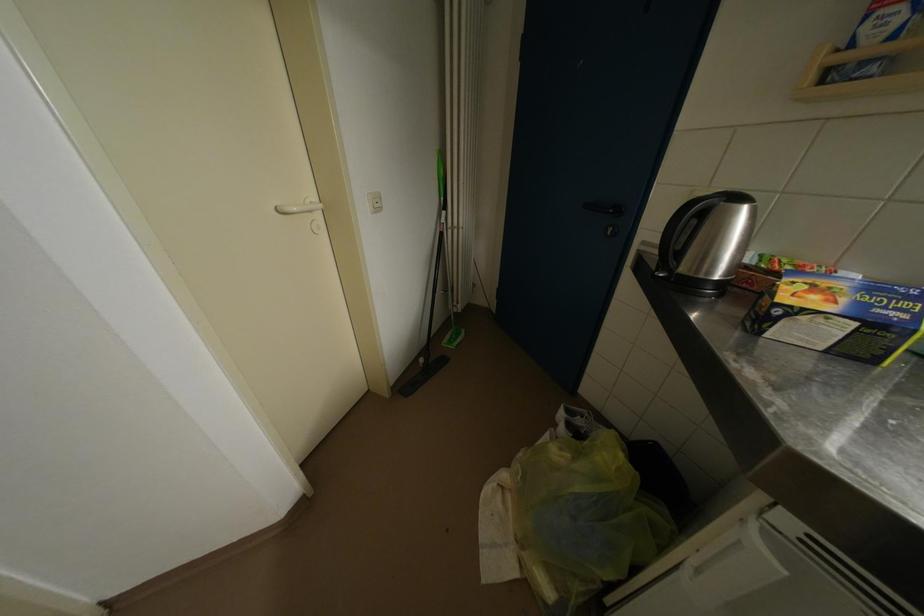
Where is `black door handle`? This screenshot has height=616, width=924. black door handle is located at coordinates pyautogui.click(x=614, y=213).